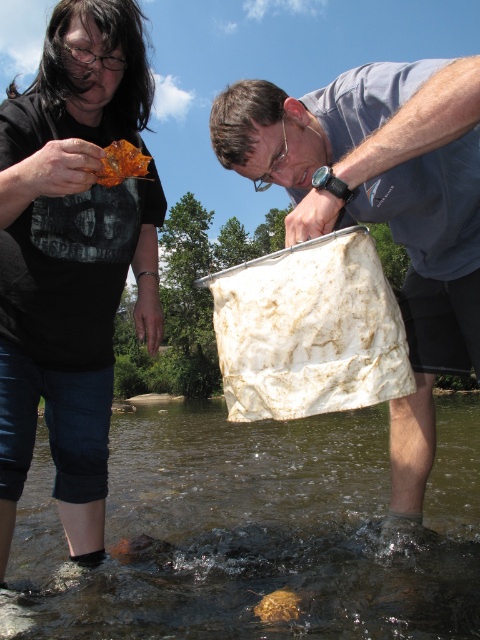
You are standing at the point marked by the coordinates point (72,257) in the image. What object is directly in front of you?

The point (72,257) is on the amber glass leaf at upper left, so the object directly in front of you is the amber glass leaf at upper left.

You are a hiker who has just arrived at the river scene described. You need to collect water samples for testing. The container held by the man is already used. Where should you place the translucent plastic bag at lower center to ensure it is not in the way of the man and woman?

The translucent plastic bag at lower center should be placed away from the individuals to avoid obstructing their current activity. Since it is located at point (x=253, y=531), moving it slightly to the side or behind them would keep it out of the way while still being accessible for collecting water samples.